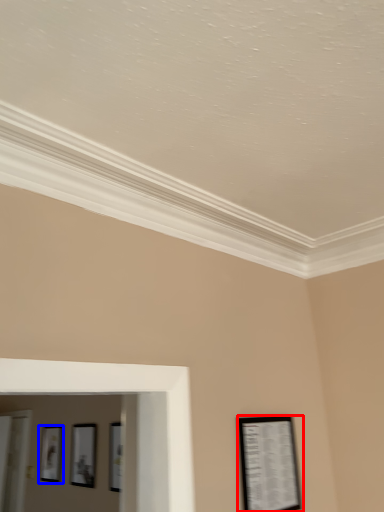
Question: Among these objects, which one is nearest to the camera, picture frame (highlighted by a red box) or picture frame (highlighted by a blue box)?

Choices:
 (A) picture frame
 (B) picture frame

Answer: (A)